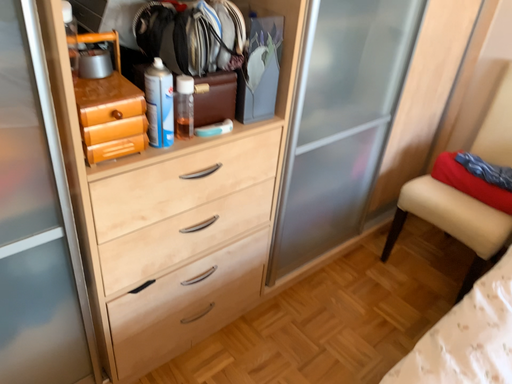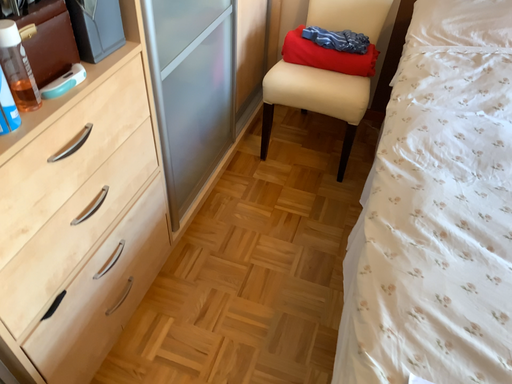
Question: How did the camera likely rotate when shooting the video?

Choices:
 (A) rotated left
 (B) rotated right

Answer: (B)